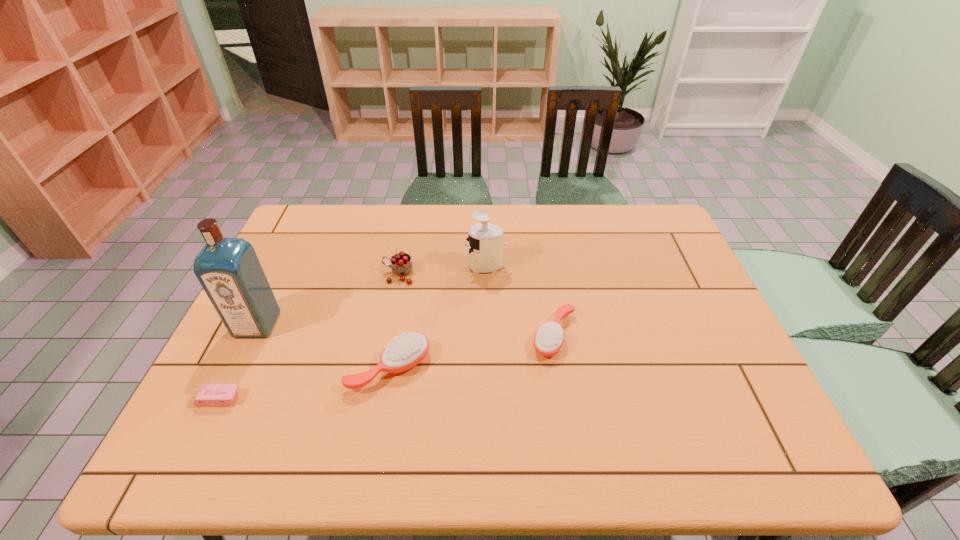
At what (x,y) coordinates should I click in order to perform the action: click on vacant position in the image that satisfies the following two spatial constraints: 1. on the handle side of the juicer; 2. on the right side of the cherry. Please return your answer as a coordinate pair (x, y). Looking at the image, I should click on (400, 266).

You are a GUI agent. You are given a task and a screenshot of the screen. Output one action in this format:
    pyautogui.click(x=<x>, y=<y>)
    Task: Click on the vacant space that satisfies the following two spatial constraints: 1. on the back side of the taller hairbrush; 2. on the right side of the shortest object
    The image size is (960, 540).
    Given the screenshot: What is the action you would take?
    (x=234, y=368)

The image size is (960, 540). I want to click on free space in the image that satisfies the following two spatial constraints: 1. on the flat label side of the rightmost object; 2. on the left side of the liquor, so click(x=252, y=336).

Locate an element on the screen. The image size is (960, 540). free location that satisfies the following two spatial constraints: 1. on the flat label side of the left hairbrush; 2. on the left side of the tallest object is located at coordinates (x=236, y=368).

Find the location of a particular element. This screenshot has height=540, width=960. free space that satisfies the following two spatial constraints: 1. on the back side of the eraser; 2. on the left side of the rightmost object is located at coordinates (250, 336).